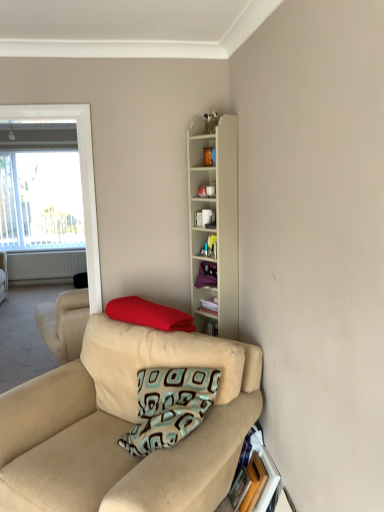
Based on the photo, measure the distance between point (248,481) and camera.

Point (248,481) is 2.15 meters away from camera.

This screenshot has height=512, width=384. Identify the location of red fabric pillow at center. (149, 314).

You are a GUI agent. You are given a task and a screenshot of the screen. Output one action in this format:
    pyautogui.click(x=<x>, y=<y>)
    Task: Click on the white matte radiator at left
    Image resolution: width=384 pixels, height=512 pixels.
    Given the screenshot: What is the action you would take?
    pyautogui.click(x=45, y=265)

Image resolution: width=384 pixels, height=512 pixels. What do you see at coordinates (123, 434) in the screenshot? I see `beige fabric couch at lower left` at bounding box center [123, 434].

This screenshot has height=512, width=384. I want to click on wooden picture frame at lower right, so click(239, 489).

Could you tell me if red fabric pillow at center is turned towards beige fabric couch at lower left?

No, red fabric pillow at center is not turned towards beige fabric couch at lower left.

Does red fabric pillow at center touch beige fabric couch at lower left?

No, red fabric pillow at center is not beside beige fabric couch at lower left.

From a real-world perspective, is red fabric pillow at center positioned above or below beige fabric couch at lower left?

From a real-world perspective, red fabric pillow at center is physically above beige fabric couch at lower left.

What's the angular difference between red fabric pillow at center and beige fabric couch at lower left's facing directions?

The facing directions of red fabric pillow at center and beige fabric couch at lower left are 4.75 degrees apart.

Is the depth of beige fabric couch at lower left greater than that of beige wood cabinet at upper center?

No, it is in front of beige wood cabinet at upper center.

Consider the image. Is beige fabric couch at lower left shorter than beige wood cabinet at upper center?

Indeed, beige fabric couch at lower left has a lesser height compared to beige wood cabinet at upper center.

Is beige fabric couch at lower left directly adjacent to beige wood cabinet at upper center?

There is a gap between beige fabric couch at lower left and beige wood cabinet at upper center.

From the image's perspective, which is below, beige fabric couch at lower left or beige wood cabinet at upper center?

From the image's view, beige fabric couch at lower left is below.

Between wooden picture frame at lower right and white matte radiator at left, which one appears on the left side from the viewer's perspective?

From the viewer's perspective, white matte radiator at left appears more on the left side.

Can you confirm if wooden picture frame at lower right is smaller than white matte radiator at left?

Correct, wooden picture frame at lower right occupies less space than white matte radiator at left.

Find the location of a particular element. Image resolution: width=384 pixels, height=512 pixels. radiator positioned vertically above the wooden picture frame at lower right (from a real-world perspective) is located at coordinates (45, 265).

From the image's perspective, between beige fabric couch at lower left and wooden picture frame at lower right, which one is located above?

beige fabric couch at lower left is shown above in the image.

From a real-world perspective, is beige fabric couch at lower left positioned under wooden picture frame at lower right based on gravity?

No.

Does beige fabric couch at lower left have a lesser width compared to wooden picture frame at lower right?

Incorrect, the width of beige fabric couch at lower left is not less than that of wooden picture frame at lower right.

Identify the location of radiator on the left of beige wood cabinet at upper center. (45, 265).

Is beige wood cabinet at upper center positioned with its back to white matte radiator at left?

beige wood cabinet at upper center is not turned away from white matte radiator at left.

Is point (231, 233) closer or farther from the camera than point (48, 266)?

Point (231, 233) is closer to the camera than point (48, 266).

Is beige wood cabinet at upper center closer to camera compared to white matte radiator at left?

Yes, it is in front of white matte radiator at left.

Is beige wood cabinet at upper center oriented away from wooden picture frame at lower right?

No, beige wood cabinet at upper center's orientation is not away from wooden picture frame at lower right.

Does point (228, 162) come behind point (239, 473)?

Yes, it is.

What's the angular difference between beige wood cabinet at upper center and wooden picture frame at lower right's facing directions?

beige wood cabinet at upper center and wooden picture frame at lower right are facing 37.2 degrees away from each other.

Considering the sizes of objects beige wood cabinet at upper center and wooden picture frame at lower right in the image provided, who is wider, beige wood cabinet at upper center or wooden picture frame at lower right?

beige wood cabinet at upper center is wider.

Considering the sizes of beige wood cabinet at upper center and red fabric pillow at center in the image, is beige wood cabinet at upper center wider or thinner than red fabric pillow at center?

beige wood cabinet at upper center is thinner than red fabric pillow at center.

Considering the sizes of objects beige wood cabinet at upper center and red fabric pillow at center in the image provided, who is bigger, beige wood cabinet at upper center or red fabric pillow at center?

beige wood cabinet at upper center.

Which of these two, beige wood cabinet at upper center or red fabric pillow at center, stands shorter?

red fabric pillow at center is shorter.

Find the location of a particular element. pillow above the beige fabric couch at lower left (from a real-world perspective) is located at coordinates (149, 314).

You are a GUI agent. You are given a task and a screenshot of the screen. Output one action in this format:
    pyautogui.click(x=<x>, y=<y>)
    Task: Click on the studio couch in front of the beige wood cabinet at upper center
    The image size is (384, 512).
    Given the screenshot: What is the action you would take?
    pyautogui.click(x=123, y=434)

From the picture: Which object lies further to the anchor point beige wood cabinet at upper center, white matte radiator at left or wooden picture frame at lower right?

white matte radiator at left is further to beige wood cabinet at upper center.

When comparing their distances from white matte radiator at left, does beige wood cabinet at upper center or beige fabric couch at lower left seem closer?

beige wood cabinet at upper center is closer to white matte radiator at left.

Which object lies further to the anchor point wooden picture frame at lower right, white matte radiator at left or beige fabric couch at lower left?

white matte radiator at left is further to wooden picture frame at lower right.

Looking at the image, which one is located further to wooden picture frame at lower right, red fabric pillow at center or beige wood cabinet at upper center?

Based on the image, beige wood cabinet at upper center appears to be further to wooden picture frame at lower right.

Estimate the real-world distances between objects in this image. Which object is closer to wooden picture frame at lower right, beige fabric couch at lower left or beige wood cabinet at upper center?

beige fabric couch at lower left is closer to wooden picture frame at lower right.

Based on their spatial positions, is red fabric pillow at center or beige wood cabinet at upper center closer to beige fabric couch at lower left?

The object closer to beige fabric couch at lower left is red fabric pillow at center.

Based on their spatial positions, is beige fabric couch at lower left or beige wood cabinet at upper center closer to red fabric pillow at center?

beige fabric couch at lower left is closer to red fabric pillow at center.

Which object lies further to the anchor point wooden picture frame at lower right, beige wood cabinet at upper center or beige fabric couch at lower left?

The object further to wooden picture frame at lower right is beige wood cabinet at upper center.

Where is `studio couch that lies between beige wood cabinet at upper center and wooden picture frame at lower right from top to bottom`? studio couch that lies between beige wood cabinet at upper center and wooden picture frame at lower right from top to bottom is located at coordinates (123, 434).

Find the location of a particular element. The image size is (384, 512). cabinetry between beige fabric couch at lower left and white matte radiator at left in the front-back direction is located at coordinates (214, 223).

Where is `pillow between beige fabric couch at lower left and white matte radiator at left from front to back`? This screenshot has height=512, width=384. pillow between beige fabric couch at lower left and white matte radiator at left from front to back is located at coordinates (149, 314).

This screenshot has height=512, width=384. In order to click on cabinetry located between red fabric pillow at center and white matte radiator at left in the depth direction in this screenshot , I will do `click(214, 223)`.